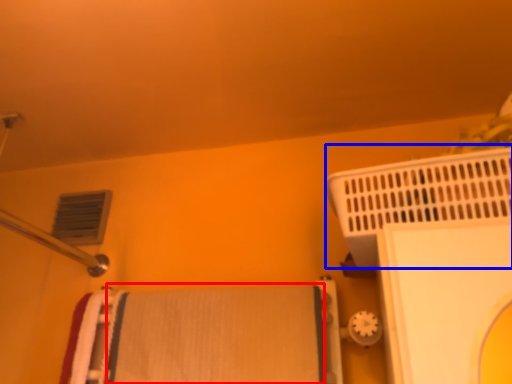
Question: Among these objects, which one is nearest to the camera, bath towel (highlighted by a red box) or bath heater (highlighted by a blue box)?

Choices:
 (A) bath towel
 (B) bath heater

Answer: (B)